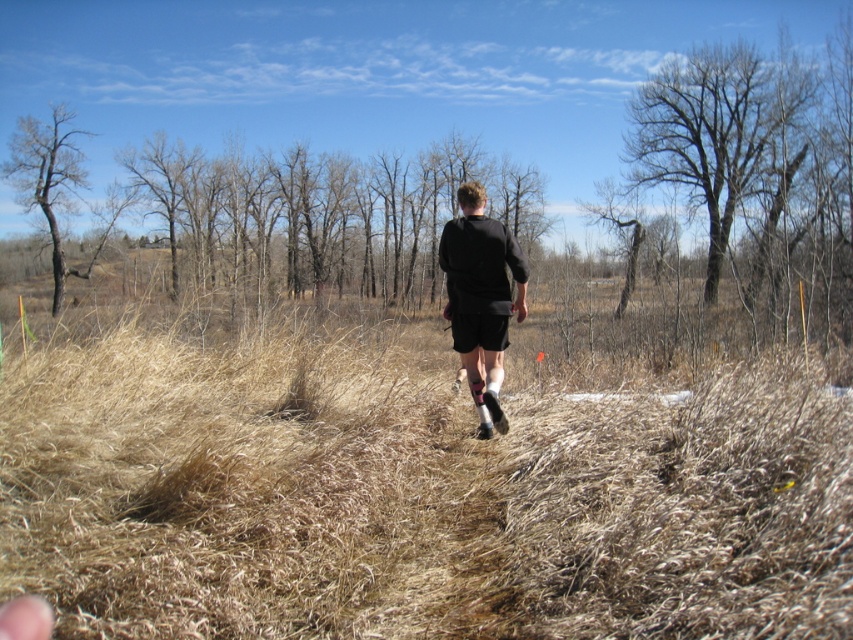
Which is more to the right, bare branches at center or bare wood tree at upper right?

bare wood tree at upper right

Who is lower down, bare branches at center or bare wood tree at upper right?

bare branches at center is lower down.

Describe the element at coordinates (326, 214) in the screenshot. The width and height of the screenshot is (853, 640). I see `bare branches at center` at that location.

Locate an element on the screen. bare branches at center is located at coordinates (326, 214).

Between bare branches at center and brown bark tree at left, which one is positioned lower?

bare branches at center is below.

Can you confirm if bare branches at center is positioned above brown bark tree at left?

Actually, bare branches at center is below brown bark tree at left.

Between point (515, 176) and point (61, 128), which one is positioned in front?

Point (61, 128) is in front.

This screenshot has width=853, height=640. Identify the location of bare branches at center. (326, 214).

Which of these two, brown dry grass at center or brown bark tree at left, stands taller?

Standing taller between the two is brown bark tree at left.

Can you confirm if brown dry grass at center is positioned above brown bark tree at left?

Actually, brown dry grass at center is below brown bark tree at left.

Does point (801, 632) come behind point (62, 289)?

No, it is in front of (62, 289).

Where is `brown dry grass at center`? Image resolution: width=853 pixels, height=640 pixels. brown dry grass at center is located at coordinates (415, 492).